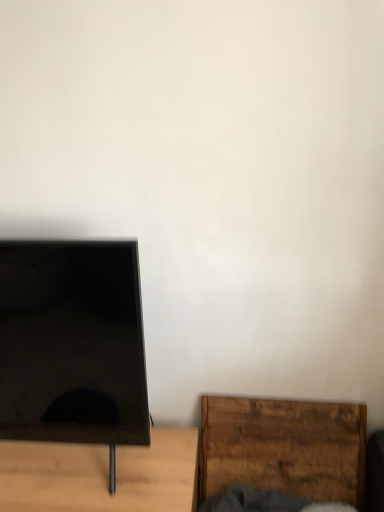
Question: In terms of height, does black matte tv stand at left, the first furniture viewed from the left, look taller or shorter compared to black glossy screen at left?

Choices:
 (A) tall
 (B) short

Answer: (B)

Question: From the image's perspective, is black matte tv stand at left, positioned as the 2th furniture in right-to-left order, located above or below black glossy screen at left?

Choices:
 (A) below
 (B) above

Answer: (A)

Question: Which is farther from the wooden cutting board at lower right, positioned as the first furniture in right-to-left order?

Choices:
 (A) black matte tv stand at left, the first furniture viewed from the left
 (B) black glossy screen at left

Answer: (B)

Question: Based on their relative distances, which object is farther from the black glossy screen at left?

Choices:
 (A) black matte tv stand at left, positioned as the 2th furniture in right-to-left order
 (B) wooden cutting board at lower right, positioned as the first furniture in right-to-left order

Answer: (B)